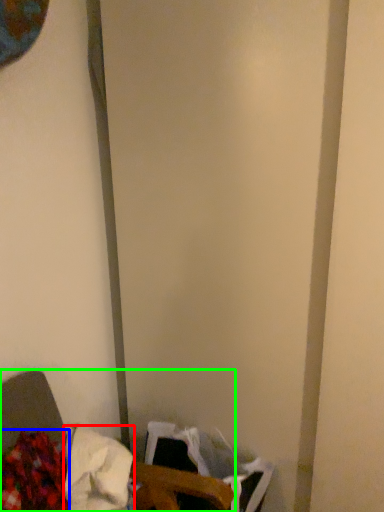
Question: Which object is positioned closest to waste (highlighted by a red box)? Select from waste (highlighted by a blue box) and furniture (highlighted by a green box).

Choices:
 (A) waste
 (B) furniture

Answer: (B)